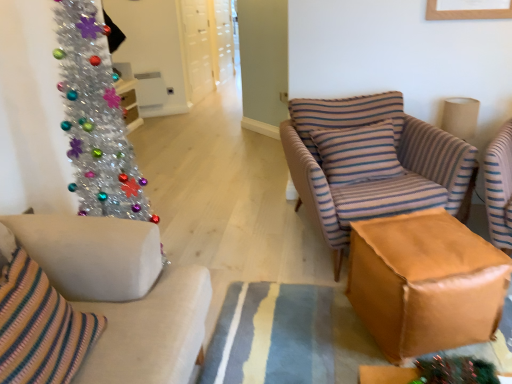
The height and width of the screenshot is (384, 512). What are the coordinates of `free space that is in between striped fabric armchair at center and shiny metallic christmas tree at left` in the screenshot? It's located at (247, 260).